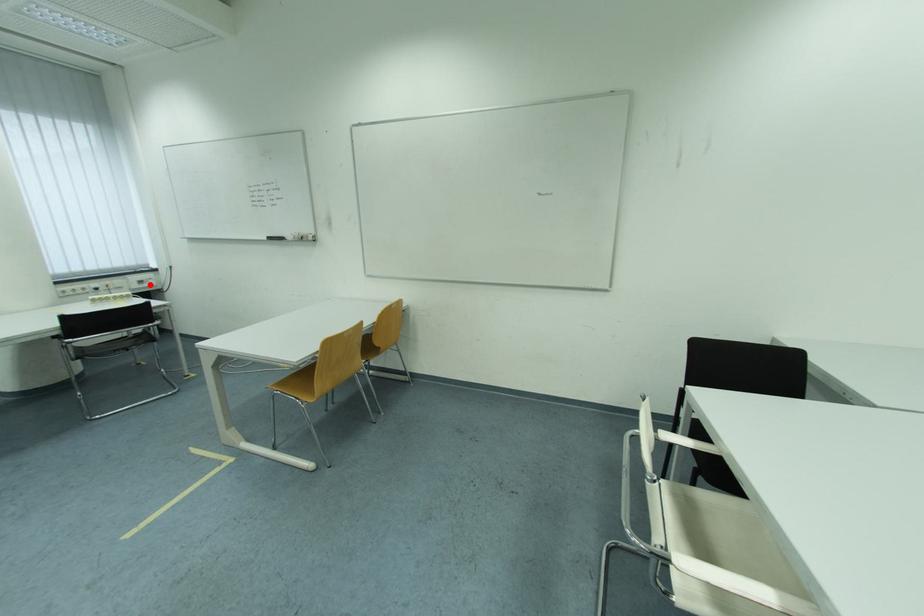
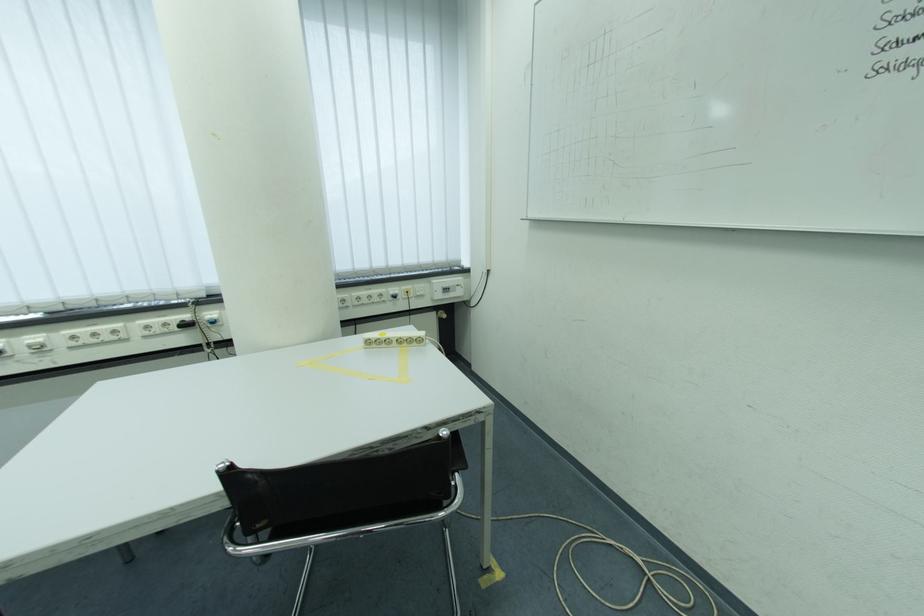
Find the pixel in the second image that matches the highlighted location in the first image.

(455, 292)